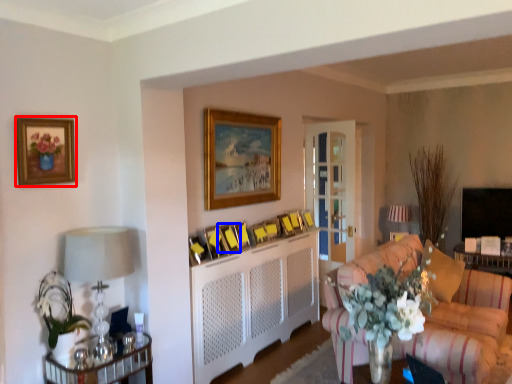
Question: Which object is further to the camera taking this photo, picture frame (highlighted by a red box) or picture frame (highlighted by a blue box)?

Choices:
 (A) picture frame
 (B) picture frame

Answer: (B)